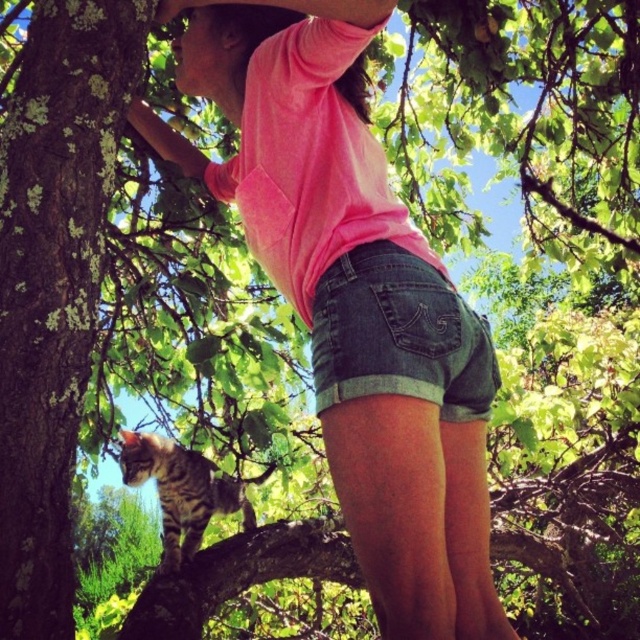
Find the location of a particular element. This screenshot has height=640, width=640. denim shorts at center is located at coordinates (397, 336).

Does denim shorts at center come behind tabby fur cat at center?

No.

Which is in front, point (422, 381) or point (224, 509)?

Point (422, 381) is more forward.

This screenshot has width=640, height=640. I want to click on denim shorts at center, so click(x=397, y=336).